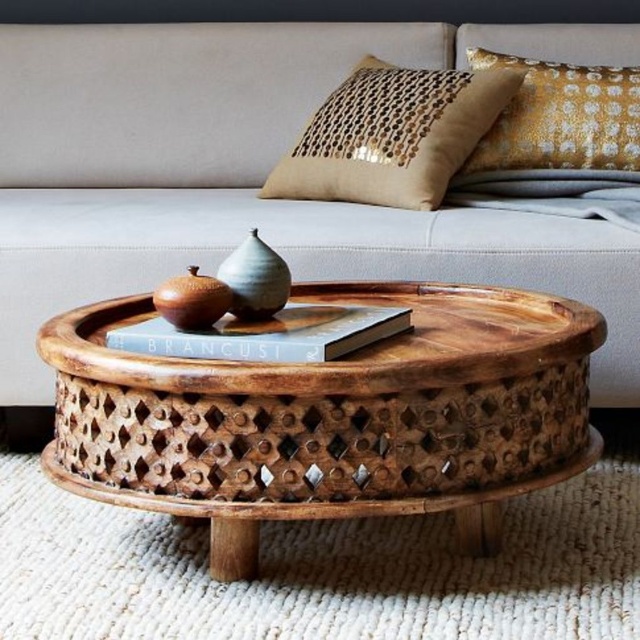
Looking at this image, you are planning to place a new rectangular side table between the neutral fabric couch at center and the gold sequined pillow at upper right. The side table is 1.2 meters wide. Can the side table fit in the space between them?

The neutral fabric couch at center is wider than the gold sequined pillow at upper right. However, the description does not provide the exact distance between them, so it is unclear if the 1.2 meter wide side table can fit. More information about the spacing between the two objects is needed to determine this.

You are organizing a small gathering and need to place a large centerpiece on the table. The neutral fabric couch at center and the gold textured pillow at upper right are both in the room. Which object should you avoid placing the centerpiece near to ensure there is enough space?

You should avoid placing the centerpiece near the gold textured pillow at upper right because the neutral fabric couch at center is bigger and would require more space, leaving less room for the centerpiece. The gold textured pillow at upper right is smaller, so placing the centerpiece near it would allow more space.

You are arranging a small tray of snacks to place on the coffee table. The tray requires 12 inches of space. Can you place it between the neutral fabric couch at center and the gold textured pillow at upper right?

The neutral fabric couch at center is only 10.08 inches from the gold textured pillow at upper right, which is less than the required 12 inches. Therefore, the tray cannot be placed between them.